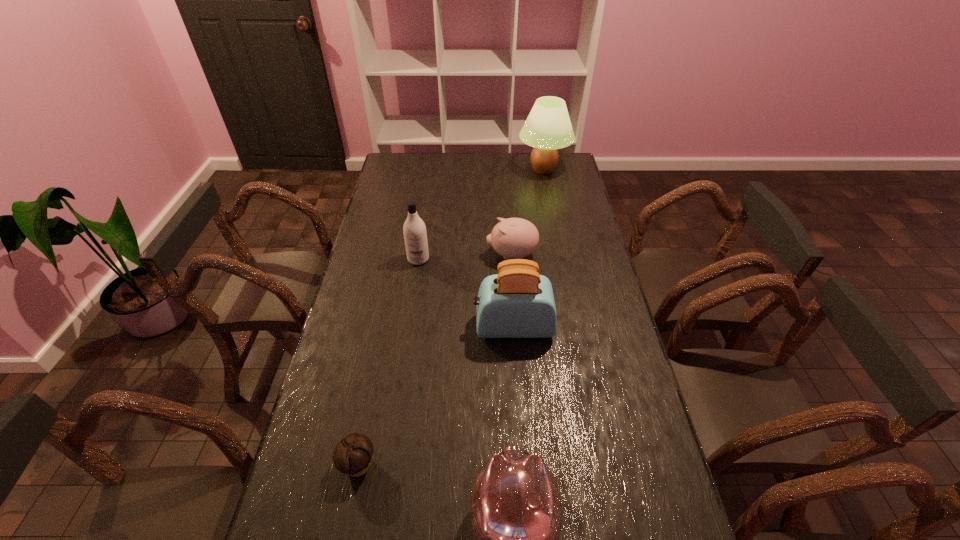
Identify the location of vacant position located on the side of the toaster with the lever. (367, 327).

I want to click on vacant space located 0.250m on the side of the toaster with the lever, so click(x=397, y=327).

Find the location of `vacant space located 0.100m on the side of the toaster with the lever`. vacant space located 0.100m on the side of the toaster with the lever is located at coordinates (444, 327).

The width and height of the screenshot is (960, 540). I want to click on vacant space positioned on the front-facing side of the shampoo, so click(x=405, y=349).

The width and height of the screenshot is (960, 540). In order to click on free location located 0.070m at the snout of the shorter piggy bank in this screenshot , I will do `click(468, 255)`.

Locate an element on the screen. vacant space situated 0.290m at the snout of the shorter piggy bank is located at coordinates (411, 255).

Identify the location of free space located at the snout of the shorter piggy bank. (434, 255).

This screenshot has width=960, height=540. Identify the location of vacant region located 0.100m on the left of the muffin. (300, 464).

Locate an element on the screen. This screenshot has width=960, height=540. object that is positioned at the far edge is located at coordinates coord(548,127).

This screenshot has height=540, width=960. Find the location of `object that is at the left edge`. object that is at the left edge is located at coordinates point(353,455).